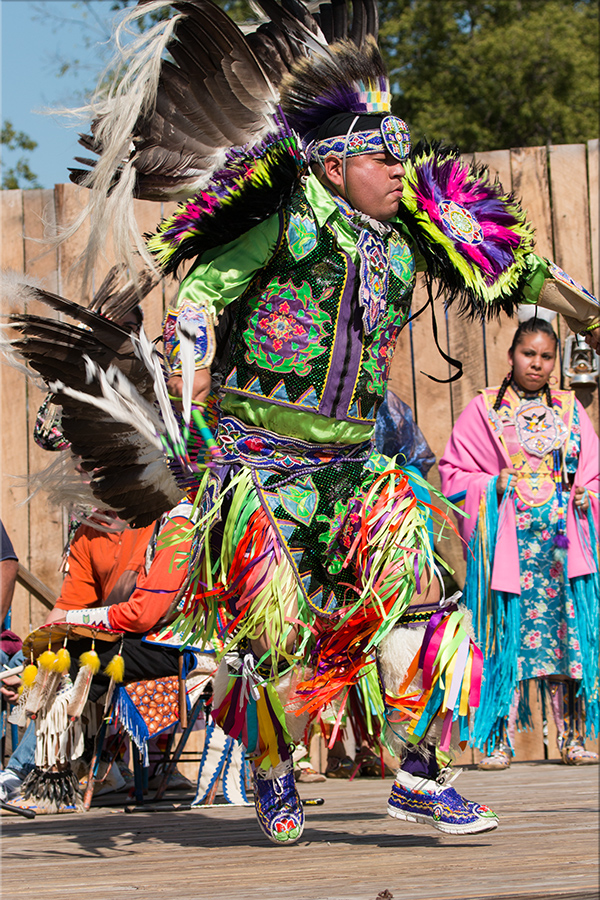
The width and height of the screenshot is (600, 900). What are the coordinates of `dance floor` in the screenshot? It's located at (111, 860), (222, 832), (254, 880), (383, 865), (524, 856), (572, 803), (507, 801).